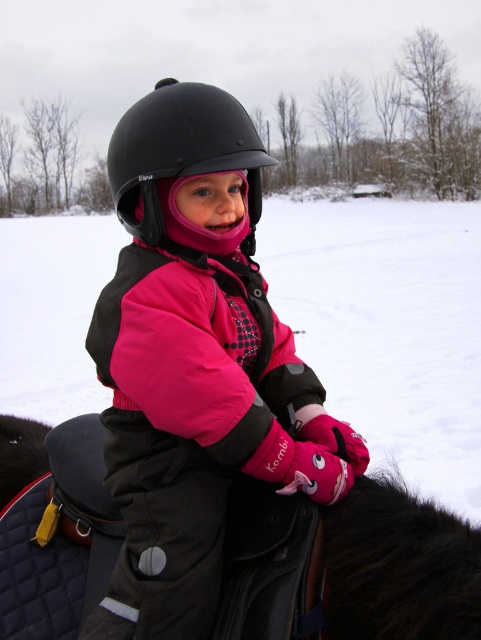
Question: Which is farther from the black matte helmet at center?

Choices:
 (A) white powdery snow at center
 (B) black leather saddle at center

Answer: (A)

Question: Can you confirm if white powdery snow at center is positioned above black leather saddle at center?

Choices:
 (A) no
 (B) yes

Answer: (B)

Question: Can you confirm if pink matte jacket at center is wider than black leather saddle at center?

Choices:
 (A) yes
 (B) no

Answer: (A)

Question: Which point is closer to the camera?

Choices:
 (A) black leather saddle at center
 (B) white powdery snow at center
 (C) black matte helmet at center

Answer: (A)

Question: Which point is closer to the camera taking this photo?

Choices:
 (A) (285, 336)
 (B) (402, 252)
 (C) (125, 227)

Answer: (C)

Question: Can you confirm if pink matte jacket at center is smaller than black matte helmet at center?

Choices:
 (A) yes
 (B) no

Answer: (B)